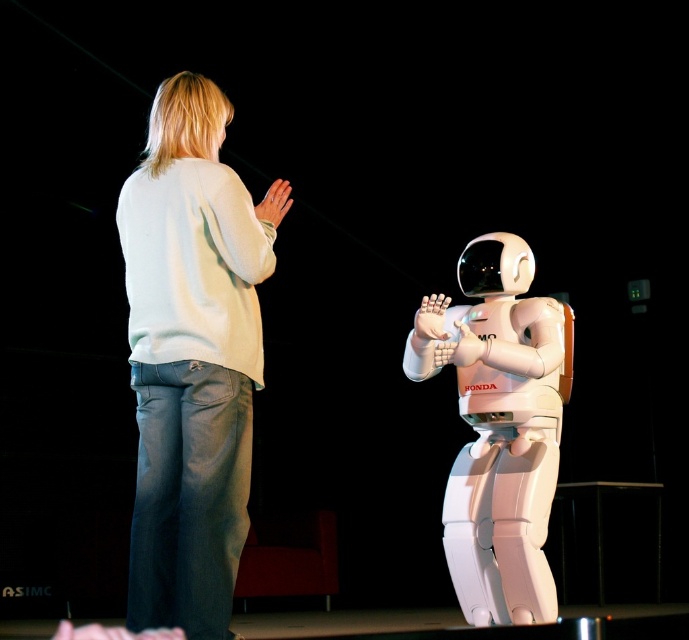
Question: Does white cotton sweater at upper left appear under white matte astronaut at center?

Choices:
 (A) no
 (B) yes

Answer: (A)

Question: Is white cotton sweater at upper left to the right of white matte astronaut at center from the viewer's perspective?

Choices:
 (A) no
 (B) yes

Answer: (A)

Question: Does white cotton sweater at upper left appear under white matte astronaut at center?

Choices:
 (A) no
 (B) yes

Answer: (A)

Question: Which object is farther from the camera taking this photo?

Choices:
 (A) white cotton sweater at upper left
 (B) white matte astronaut at center

Answer: (B)